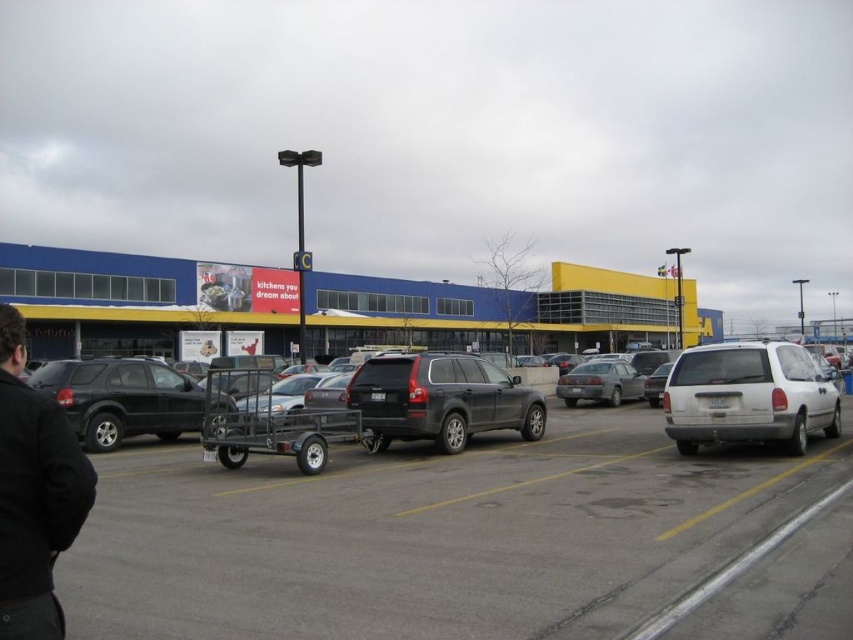
Question: Can you confirm if matte black trailer at center is positioned to the left of white matte minivan at right?

Choices:
 (A) no
 (B) yes

Answer: (B)

Question: Is matte black trailer at center above matte black suv at left?

Choices:
 (A) yes
 (B) no

Answer: (A)

Question: Does black metal trailer at center appear over matte black trailer at center?

Choices:
 (A) yes
 (B) no

Answer: (B)

Question: Among these points, which one is farthest from the camera?

Choices:
 (A) (78, 419)
 (B) (67, 506)
 (C) (421, 515)
 (D) (390, 358)

Answer: (A)

Question: Among these objects, which one is nearest to the camera?

Choices:
 (A) white matte minivan at right
 (B) matte black trailer at center
 (C) matte black suv at left
 (D) black metal trailer at center

Answer: (D)

Question: Considering the real-world distances, which object is farthest from the silver metallic sedan at center?

Choices:
 (A) white matte minivan at right
 (B) matte black suv at left
 (C) black fabric jacket at lower left

Answer: (C)